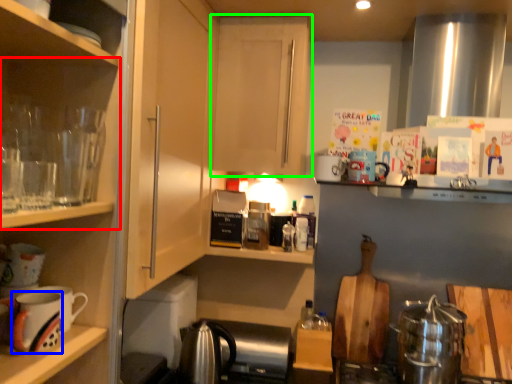
Question: Based on their relative distances, which object is nearer to shelf (highlighted by a red box)? Choose from mug (highlighted by a blue box) and cabinetry (highlighted by a green box).

Choices:
 (A) mug
 (B) cabinetry

Answer: (A)